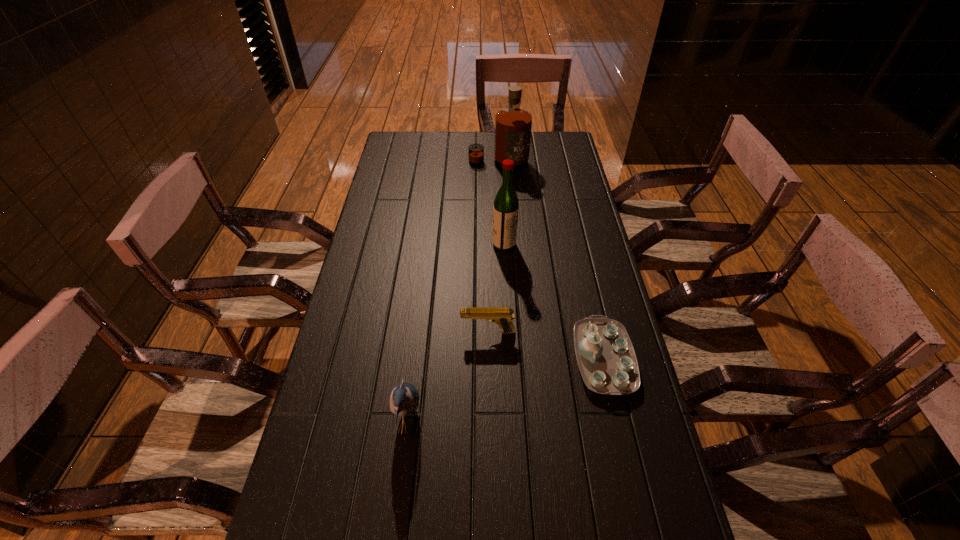
Locate an element on the screen. The width and height of the screenshot is (960, 540). vacant region located 0.390m at the tip of the leftmost object's beak is located at coordinates (586, 424).

Find the location of `vacant area situated 0.170m on the back of the rightmost object`. vacant area situated 0.170m on the back of the rightmost object is located at coordinates (586, 280).

Find the location of `vacant space located at the barrel of the pistol`. vacant space located at the barrel of the pistol is located at coordinates (368, 332).

This screenshot has height=540, width=960. I want to click on blank area located 0.090m at the barrel of the pistol, so click(x=428, y=332).

Where is `free spot located 0.180m at the barrel of the pistol`? The height and width of the screenshot is (540, 960). free spot located 0.180m at the barrel of the pistol is located at coordinates (396, 332).

Locate an element on the screen. object that is at the far edge is located at coordinates (513, 125).

Where is `object present at the right edge`? This screenshot has width=960, height=540. object present at the right edge is located at coordinates (606, 358).

At what (x,y) coordinates should I click in order to perform the action: click on vacant space at the left edge. Please return your answer as a coordinate pair (x, y). The height and width of the screenshot is (540, 960). Looking at the image, I should click on (325, 529).

Locate an element on the screen. This screenshot has height=540, width=960. vacant area at the right edge of the desktop is located at coordinates (569, 271).

At what (x,y) coordinates should I click in order to perform the action: click on free region at the far left corner of the desktop. Please return your answer as a coordinate pair (x, y). This screenshot has height=540, width=960. Looking at the image, I should click on (398, 150).